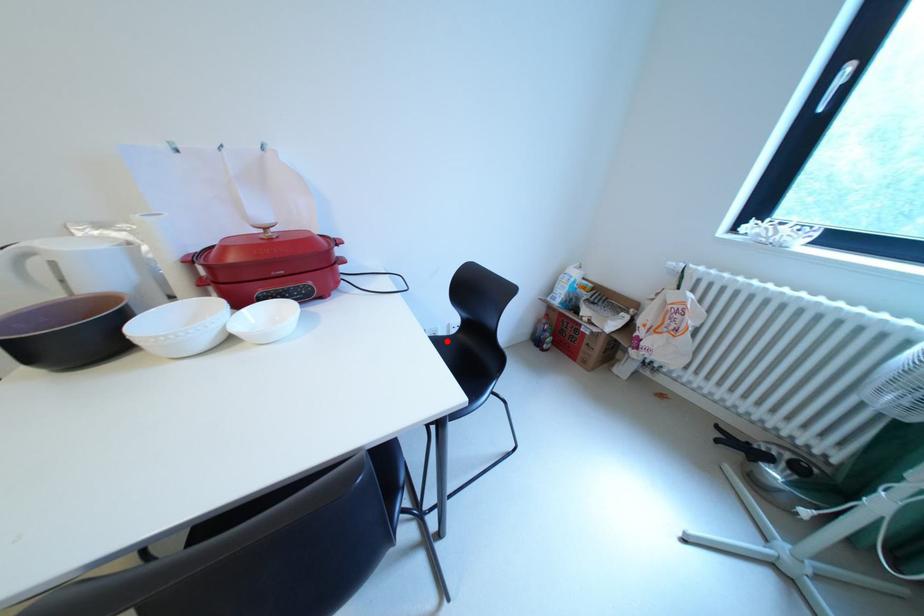
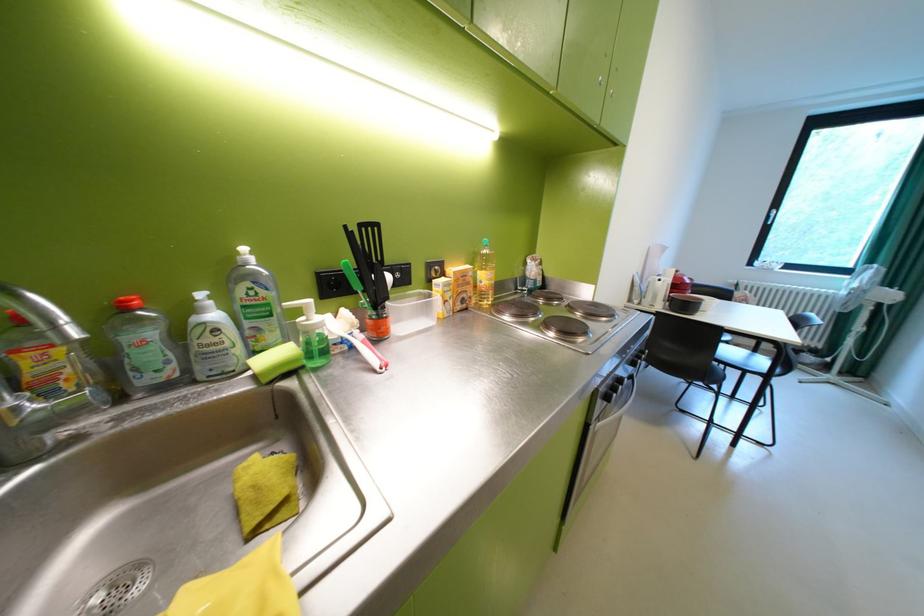
Question: I am providing you with two images of the same scene from different viewpoints. A red point is marked on the first image. At the location where the point appears in image 1, is it still visible in image 2?

Choices:
 (A) Yes
 (B) No

Answer: (B)